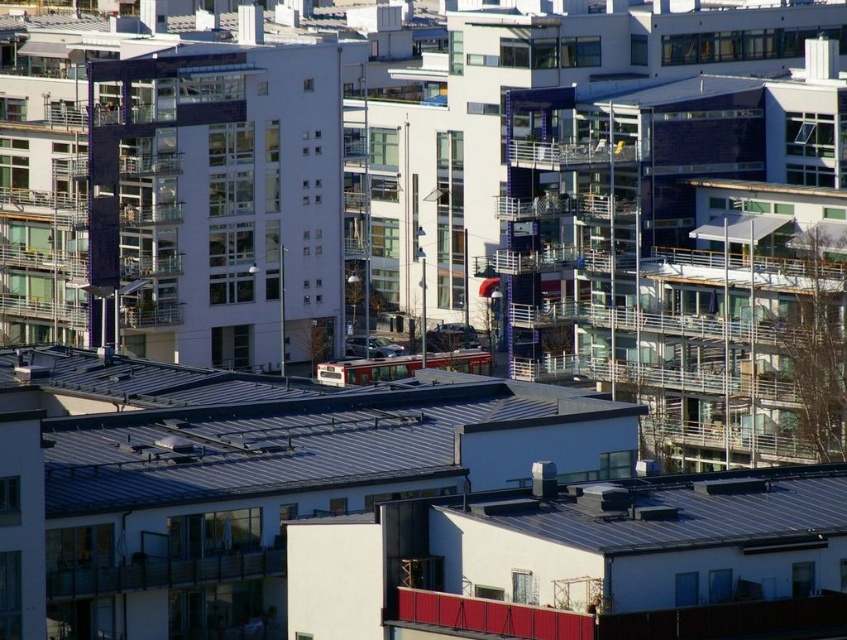
Question: Can you confirm if metallic gray roof at center is positioned below metallic gray roof at lower right?

Choices:
 (A) no
 (B) yes

Answer: (A)

Question: Can you confirm if metallic gray roof at center is bigger than metallic gray roof at lower right?

Choices:
 (A) no
 (B) yes

Answer: (B)

Question: Which object is farther from the camera taking this photo?

Choices:
 (A) metallic gray roof at lower right
 (B) metallic gray roof at center

Answer: (B)

Question: Observing the image, what is the correct spatial positioning of metallic gray roof at center in reference to metallic gray roof at lower right?

Choices:
 (A) left
 (B) right

Answer: (A)